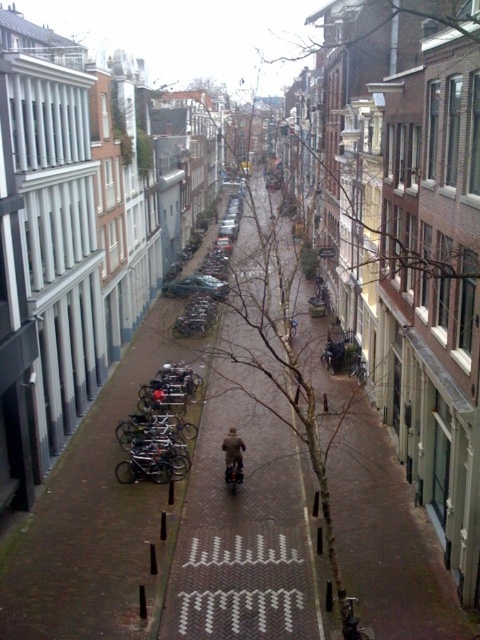
Who is positioned more to the left, brown brick pavement at center or brown leather jacket at center?

From the viewer's perspective, brown brick pavement at center appears more on the left side.

Does brown brick pavement at center have a greater width compared to brown leather jacket at center?

Yes, brown brick pavement at center is wider than brown leather jacket at center.

Is point (64, 621) positioned before point (230, 452)?

That is True.

Image resolution: width=480 pixels, height=640 pixels. Identify the location of brown brick pavement at center. (92, 520).

Identify the location of brown brick pavement at center. (92, 520).

Who is shorter, brown brick pavement at center or bare branches at center?

With less height is brown brick pavement at center.

Who is more distant from viewer, (x=132, y=356) or (x=262, y=212)?

Point (x=262, y=212)

You are a GUI agent. You are given a task and a screenshot of the screen. Output one action in this format:
    pyautogui.click(x=<x>, y=<y>)
    Task: Click on the brown brick pavement at center
    This screenshot has width=480, height=640.
    Given the screenshot: What is the action you would take?
    pyautogui.click(x=92, y=520)

Between point (241, 609) and point (229, 428), which one is positioned in front?

Point (241, 609) is more forward.

Describe the element at coordinates (255, 465) in the screenshot. The width and height of the screenshot is (480, 640). I see `bare branches at center` at that location.

At what (x,y) coordinates should I click in order to perform the action: click on bare branches at center. Please return your answer as a coordinate pair (x, y). This screenshot has width=480, height=640. Looking at the image, I should click on (255, 465).